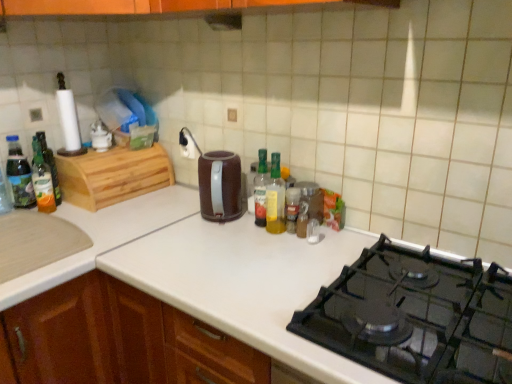
At what (x,y) coordinates should I click in order to perform the action: click on translucent plastic bottle at left, which is the first bottle from left to right. Please return your answer as a coordinate pair (x, y). The height and width of the screenshot is (384, 512). Looking at the image, I should click on (19, 175).

Describe the element at coordinates (19, 175) in the screenshot. Image resolution: width=512 pixels, height=384 pixels. I see `translucent plastic bottle at left, which is the first bottle from left to right` at that location.

At what (x,y) coordinates should I click in order to perform the action: click on black matte gas stove at lower right. Please return your answer as a coordinate pair (x, y). Looking at the image, I should click on (415, 317).

Find the location of `translucent plastic bottle at center, positioned as the third bottle in right-to-left order`. translucent plastic bottle at center, positioned as the third bottle in right-to-left order is located at coordinates (261, 189).

Measure the distance between point (232,16) and camera.

The distance of point (232,16) from camera is 4.77 feet.

Image resolution: width=512 pixels, height=384 pixels. I want to click on translucent glass bottle at left, the 4th bottle in the right-to-left sequence, so click(42, 180).

Can we say translucent glass bottle at left, the 4th bottle in the right-to-left sequence, lies outside translucent plastic bottle at left, which is the first bottle from left to right?

Yes, translucent glass bottle at left, the 4th bottle in the right-to-left sequence, is not within translucent plastic bottle at left, which is the first bottle from left to right.

Does translucent glass bottle at left, the 4th bottle in the right-to-left sequence, have a greater width compared to translucent plastic bottle at left, which is the fifth bottle in right-to-left order?

No, translucent glass bottle at left, the 4th bottle in the right-to-left sequence, is not wider than translucent plastic bottle at left, which is the fifth bottle in right-to-left order.

Is translucent glass bottle at left, placed as the 2th bottle when sorted from left to right, oriented away from translucent plastic bottle at left, which is the fifth bottle in right-to-left order?

Yes, translucent glass bottle at left, placed as the 2th bottle when sorted from left to right, is facing away from translucent plastic bottle at left, which is the fifth bottle in right-to-left order.

Is black plastic exhaust hood at upper center at the back of translucent plastic bottle at center, the third bottle when ordered from left to right?

No, translucent plastic bottle at center, the third bottle when ordered from left to right, is not facing away from black plastic exhaust hood at upper center.

Is translucent plastic bottle at center, the third bottle when ordered from left to right, located outside black plastic exhaust hood at upper center?

translucent plastic bottle at center, the third bottle when ordered from left to right, lies outside black plastic exhaust hood at upper center's area.

Looking at their sizes, would you say translucent plastic bottle at center, positioned as the third bottle in right-to-left order, is wider or thinner than black plastic exhaust hood at upper center?

Clearly, translucent plastic bottle at center, positioned as the third bottle in right-to-left order, has less width compared to black plastic exhaust hood at upper center.

Where is `the 2nd bottle directly beneath the black plastic exhaust hood at upper center (from a real-world perspective)`? The height and width of the screenshot is (384, 512). the 2nd bottle directly beneath the black plastic exhaust hood at upper center (from a real-world perspective) is located at coordinates (261, 189).

Which object is thinner, black plastic exhaust hood at upper center or translucent plastic bottle at center, positioned as the third bottle in right-to-left order?

translucent plastic bottle at center, positioned as the third bottle in right-to-left order, is thinner.

From the image's perspective, is black plastic exhaust hood at upper center located above or below translucent plastic bottle at center, positioned as the third bottle in right-to-left order?

black plastic exhaust hood at upper center is situated higher than translucent plastic bottle at center, positioned as the third bottle in right-to-left order, in the image.

Considering their positions, is black plastic exhaust hood at upper center located in front of or behind translucent plastic bottle at center, positioned as the third bottle in right-to-left order?

black plastic exhaust hood at upper center is behind translucent plastic bottle at center, positioned as the third bottle in right-to-left order.

Considering the relative sizes of black plastic exhaust hood at upper center and translucent plastic bottle at center, positioned as the third bottle in right-to-left order, in the image provided, is black plastic exhaust hood at upper center shorter than translucent plastic bottle at center, positioned as the third bottle in right-to-left order,?

Yes, black plastic exhaust hood at upper center is shorter than translucent plastic bottle at center, positioned as the third bottle in right-to-left order.

From a real-world perspective, is translucent plastic bottle at center, positioned as the second bottle in right-to-left order, physically located above or below translucent plastic bottle at center, the third bottle when ordered from left to right?

Clearly, from a real-world perspective, translucent plastic bottle at center, positioned as the second bottle in right-to-left order, is below translucent plastic bottle at center, the third bottle when ordered from left to right.

From the image's perspective, does translucent plastic bottle at center, the 4th bottle positioned from the left, appear higher than translucent plastic bottle at center, the third bottle when ordered from left to right?

No, from the image's perspective, translucent plastic bottle at center, the 4th bottle positioned from the left, is not above translucent plastic bottle at center, the third bottle when ordered from left to right.

Are translucent plastic bottle at center, the 4th bottle positioned from the left, and translucent plastic bottle at center, positioned as the third bottle in right-to-left order, beside each other?

Yes, translucent plastic bottle at center, the 4th bottle positioned from the left, is beside translucent plastic bottle at center, positioned as the third bottle in right-to-left order.

Which of these two, brown matte electric kettle at center or translucent plastic bottle at center, the 4th bottle positioned from the left, is smaller?

Smaller between the two is translucent plastic bottle at center, the 4th bottle positioned from the left.

Can you confirm if brown matte electric kettle at center is positioned to the left of translucent plastic bottle at center, the 4th bottle positioned from the left?

Correct, you'll find brown matte electric kettle at center to the left of translucent plastic bottle at center, the 4th bottle positioned from the left.

From a real-world perspective, is brown matte electric kettle at center located beneath translucent plastic bottle at center, the 4th bottle positioned from the left?

Indeed, from a real-world perspective, brown matte electric kettle at center is positioned beneath translucent plastic bottle at center, the 4th bottle positioned from the left.

Considering the positions of objects translucent plastic bottle at center, the third bottle when ordered from left to right, and black matte gas stove at lower right in the image provided, who is behind, translucent plastic bottle at center, the third bottle when ordered from left to right, or black matte gas stove at lower right?

translucent plastic bottle at center, the third bottle when ordered from left to right, is further from the camera.

From the image's perspective, is translucent plastic bottle at center, positioned as the third bottle in right-to-left order, positioned above or below black matte gas stove at lower right?

From the image's perspective, translucent plastic bottle at center, positioned as the third bottle in right-to-left order, appears above black matte gas stove at lower right.

Is translucent plastic bottle at center, the third bottle when ordered from left to right, touching black matte gas stove at lower right?

No, translucent plastic bottle at center, the third bottle when ordered from left to right, is not next to black matte gas stove at lower right.

Consider the image. Is translucent plastic bottle at left, which is the fifth bottle in right-to-left order, aimed at translucent glass bottle at left, the 4th bottle in the right-to-left sequence?

Yes, translucent plastic bottle at left, which is the fifth bottle in right-to-left order, faces towards translucent glass bottle at left, the 4th bottle in the right-to-left sequence.

Does point (13, 200) appear closer or farther from the camera than point (52, 191)?

Point (13, 200).

Is translucent plastic bottle at left, which is the fifth bottle in right-to-left order, not close to translucent glass bottle at left, placed as the 2th bottle when sorted from left to right?

No, there isn't a large distance between translucent plastic bottle at left, which is the fifth bottle in right-to-left order, and translucent glass bottle at left, placed as the 2th bottle when sorted from left to right.

Looking at their sizes, would you say translucent plastic bottle at left, which is the fifth bottle in right-to-left order, is wider or thinner than translucent glass bottle at left, the 4th bottle in the right-to-left sequence?

Considering their sizes, translucent plastic bottle at left, which is the fifth bottle in right-to-left order, looks broader than translucent glass bottle at left, the 4th bottle in the right-to-left sequence.

In order to click on bottle that is the 2nd one below the translucent plastic bottle at left, which is the first bottle from left to right (from a real-world perspective) in this screenshot , I will do `click(42, 180)`.

What are the coordinates of `bottle that is the 3rd object located below the black plastic exhaust hood at upper center (from the image's perspective)` in the screenshot? It's located at (261, 189).

When comparing their distances from black matte gas stove at lower right, does translucent plastic bottle at center, positioned as the second bottle in right-to-left order, or translucent glass bottle at left, placed as the 2th bottle when sorted from left to right, seem further?

The object further to black matte gas stove at lower right is translucent glass bottle at left, placed as the 2th bottle when sorted from left to right.

Which object lies nearer to the anchor point translucent plastic bottle at center, positioned as the second bottle in right-to-left order, translucent glass bottle at left, the 4th bottle in the right-to-left sequence, or black matte gas stove at lower right?

Based on the image, black matte gas stove at lower right appears to be nearer to translucent plastic bottle at center, positioned as the second bottle in right-to-left order.

Considering their positions, is brown matte electric kettle at center positioned further to translucent plastic bottle at center, the third bottle when ordered from left to right, than black matte gas stove at lower right?

black matte gas stove at lower right lies further to translucent plastic bottle at center, the third bottle when ordered from left to right, than the other object.

When comparing their distances from translucent plastic bottle at left, which is the fifth bottle in right-to-left order, does translucent plastic bottle at center, the 1th bottle from the right, or translucent glass bottle at left, the 4th bottle in the right-to-left sequence, seem closer?

translucent glass bottle at left, the 4th bottle in the right-to-left sequence, lies closer to translucent plastic bottle at left, which is the fifth bottle in right-to-left order, than the other object.

Estimate the real-world distances between objects in this image. Which object is further from translucent plastic bottle at center, positioned as the second bottle in right-to-left order, black plastic exhaust hood at upper center or brown matte electric kettle at center?

black plastic exhaust hood at upper center.

Based on the photo, when comparing their distances from brown matte electric kettle at center, does black plastic exhaust hood at upper center or translucent plastic bottle at center, the 4th bottle positioned from the left, seem closer?

The object closer to brown matte electric kettle at center is translucent plastic bottle at center, the 4th bottle positioned from the left.

From the image, which object appears to be farther from black matte gas stove at lower right, translucent plastic bottle at center, the 4th bottle positioned from the left, or black plastic exhaust hood at upper center?

Among the two, black plastic exhaust hood at upper center is located further to black matte gas stove at lower right.

Considering their positions, is black plastic exhaust hood at upper center positioned further to translucent plastic bottle at center, the fifth bottle from the left, than translucent glass bottle at left, placed as the 2th bottle when sorted from left to right?

translucent glass bottle at left, placed as the 2th bottle when sorted from left to right.

The image size is (512, 384). Find the location of `bottle between translucent plastic bottle at left, which is the first bottle from left to right, and brown matte electric kettle at center from left to right`. bottle between translucent plastic bottle at left, which is the first bottle from left to right, and brown matte electric kettle at center from left to right is located at coordinates (42, 180).

In order to click on kitchen appliance between black matte gas stove at lower right and translucent plastic bottle at center, the third bottle when ordered from left to right, from front to back in this screenshot , I will do `click(220, 186)`.

Find the location of a particular element. Image resolution: width=512 pixels, height=384 pixels. bottle between brown matte electric kettle at center and translucent plastic bottle at center, the 4th bottle positioned from the left is located at coordinates [x=261, y=189].

At what (x,y) coordinates should I click in order to perform the action: click on exhaust hood between translucent plastic bottle at left, which is the first bottle from left to right, and black matte gas stove at lower right. Please return your answer as a coordinate pair (x, y). Looking at the image, I should click on (224, 21).